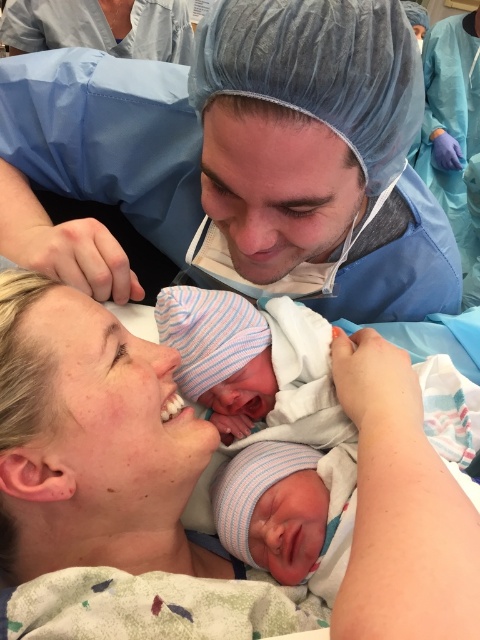
Question: Which of the following is the closest to the observer?

Choices:
 (A) smooth skin face at lower left
 (B) blue mesh cap at upper center
 (C) striped knit cap at center
 (D) blue smooth scrubs at upper right

Answer: (A)

Question: Is striped knit cap at center wider than blue smooth scrubs at upper right?

Choices:
 (A) yes
 (B) no

Answer: (B)

Question: Which point is closer to the camera?

Choices:
 (A) (308, 10)
 (B) (395, 608)
 (C) (276, 346)

Answer: (B)

Question: Is striped knit cap at center wider than blue smooth scrubs at upper right?

Choices:
 (A) yes
 (B) no

Answer: (B)

Question: Is striped knit cap at center bigger than blue smooth scrubs at upper right?

Choices:
 (A) yes
 (B) no

Answer: (B)

Question: Among these objects, which one is farthest from the camera?

Choices:
 (A) blue smooth scrubs at upper right
 (B) smooth skin face at lower left

Answer: (A)